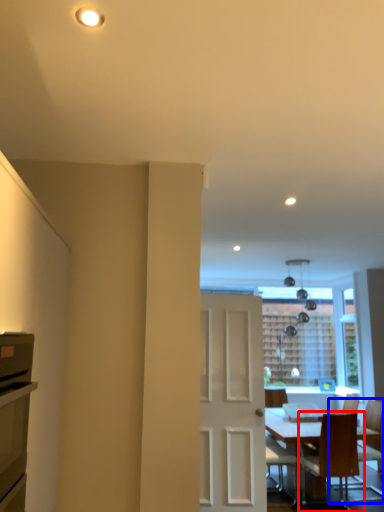
Question: Among these objects, which one is nearest to the camera, chair (highlighted by a red box) or chair (highlighted by a blue box)?

Choices:
 (A) chair
 (B) chair

Answer: (A)